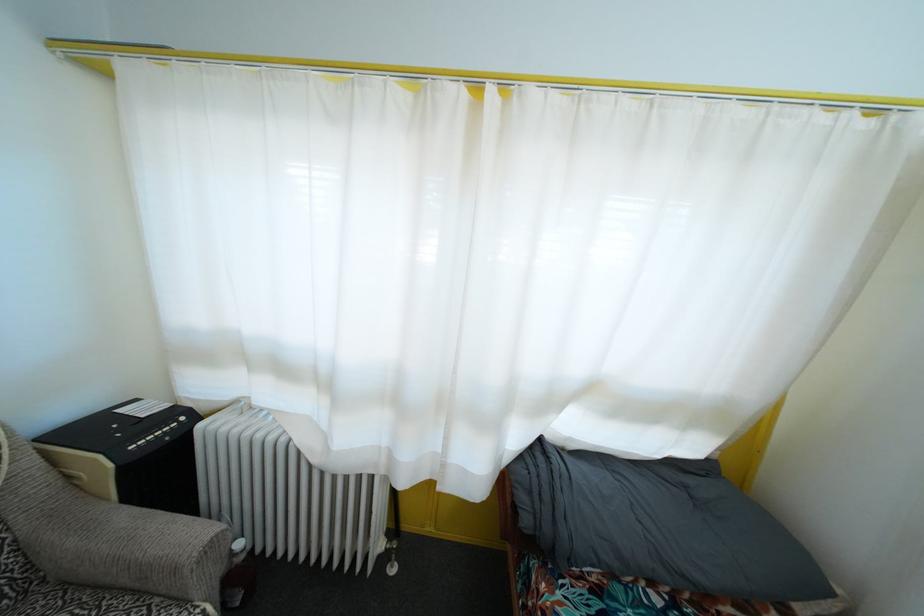
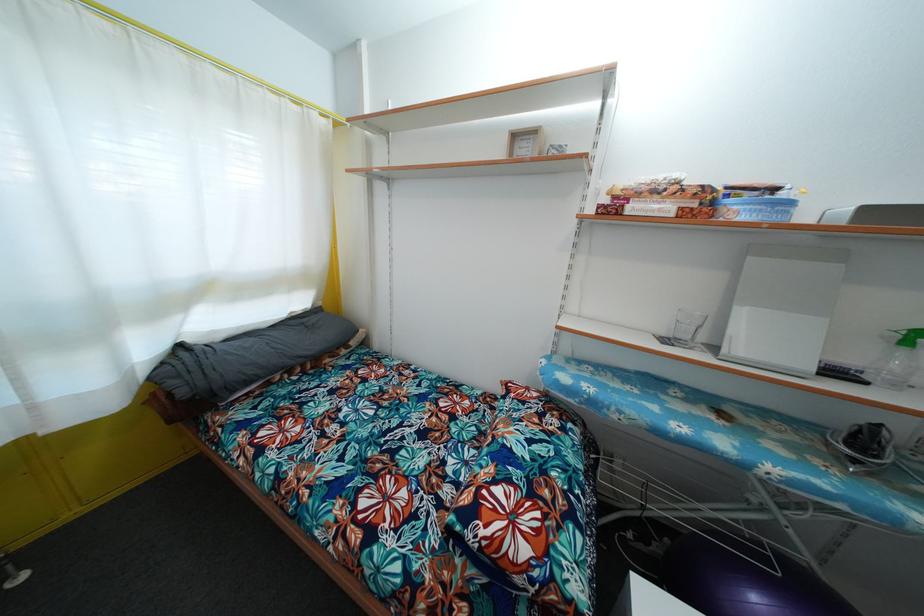
Find the pixel in the second image that matches [529,528] in the first image.

(187, 399)